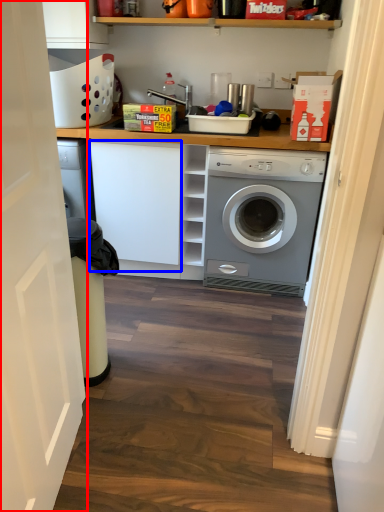
Question: Which of the following is the farthest to the observer, door (highlighted by a red box) or cabinetry (highlighted by a blue box)?

Choices:
 (A) door
 (B) cabinetry

Answer: (B)